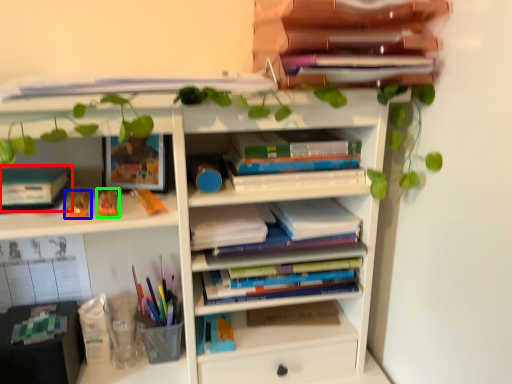
Question: Which object is the farthest from paperback book (highlighted by a red box)? Choose among these: toy (highlighted by a blue box) or toy (highlighted by a green box).

Choices:
 (A) toy
 (B) toy

Answer: (B)